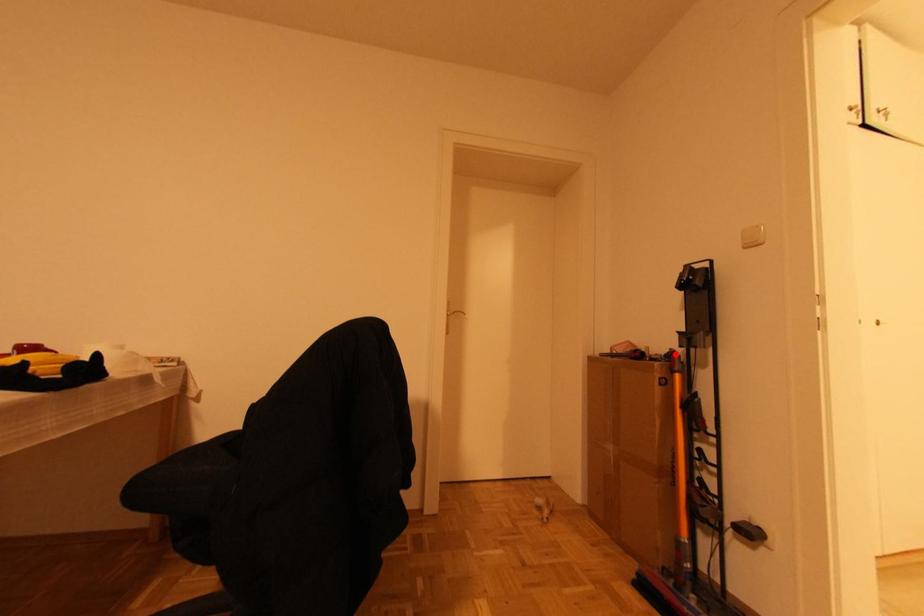
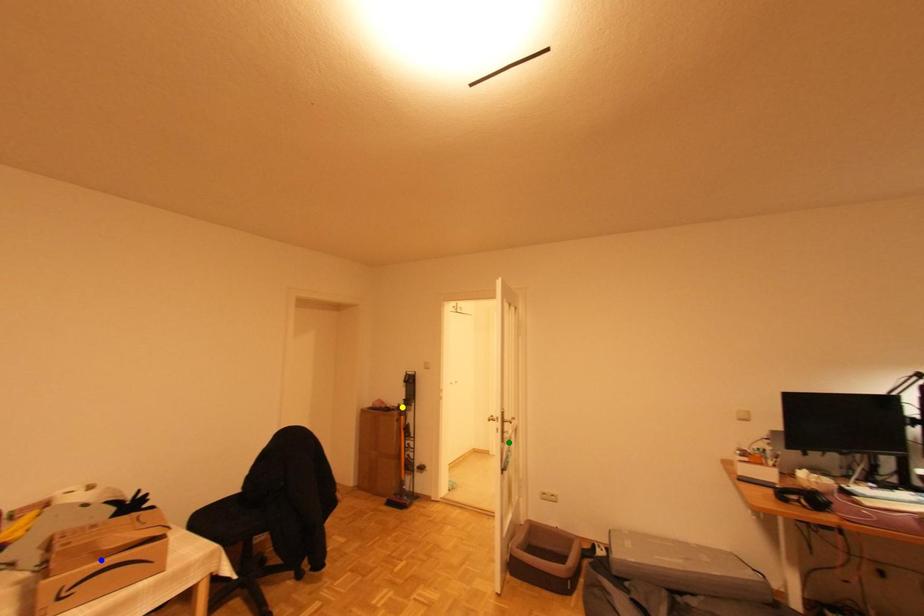
Question: I am providing you with two images of the same scene from different viewpoints. A red point is marked on the first image. You are given multiple points on the second image. In image 2, which mark is for the same physical point as the one in image 1?

Choices:
 (A) blue point
 (B) green point
 (C) yellow point

Answer: (C)